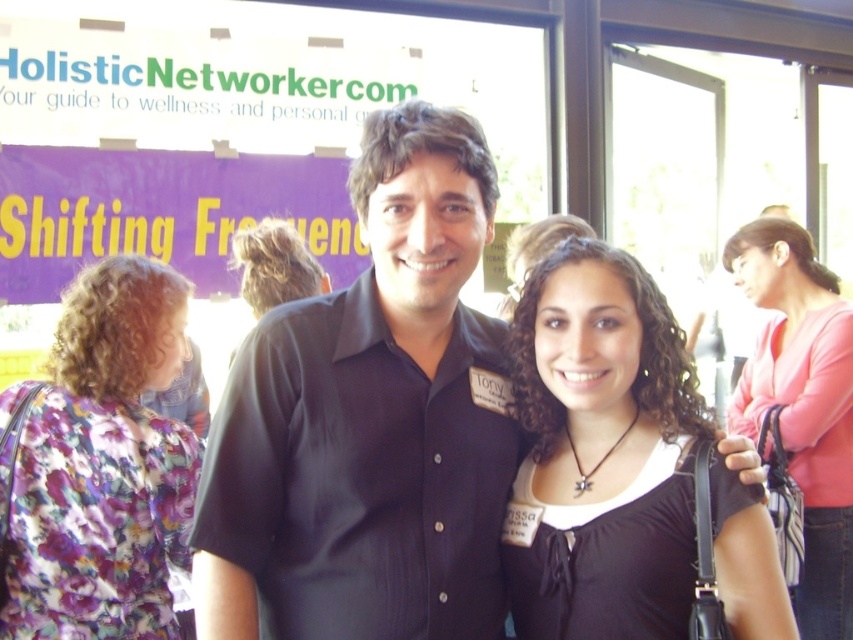
Who is higher up, black smooth shirt at center or pink fabric shirt at upper right?

Positioned higher is black smooth shirt at center.

Between black smooth shirt at center and pink fabric shirt at upper right, which one appears on the right side from the viewer's perspective?

Positioned to the right is pink fabric shirt at upper right.

Where is `black smooth shirt at center`? black smooth shirt at center is located at coordinates (370, 420).

Is point (442, 132) positioned in front of point (625, 595)?

Yes, point (442, 132) is in front of point (625, 595).

Can you confirm if black smooth shirt at center is taller than black matte shirt at center?

Indeed, black smooth shirt at center has a greater height compared to black matte shirt at center.

Image resolution: width=853 pixels, height=640 pixels. Describe the element at coordinates (370, 420) in the screenshot. I see `black smooth shirt at center` at that location.

Locate an element on the screen. black smooth shirt at center is located at coordinates (370, 420).

Between black smooth shirt at center and floral fabric dress at left, which one appears on the left side from the viewer's perspective?

floral fabric dress at left is more to the left.

Between point (450, 276) and point (180, 424), which one is positioned behind?

The point (180, 424) is behind.

Image resolution: width=853 pixels, height=640 pixels. What do you see at coordinates (370, 420) in the screenshot?
I see `black smooth shirt at center` at bounding box center [370, 420].

Identify the location of black smooth shirt at center. pos(370,420).